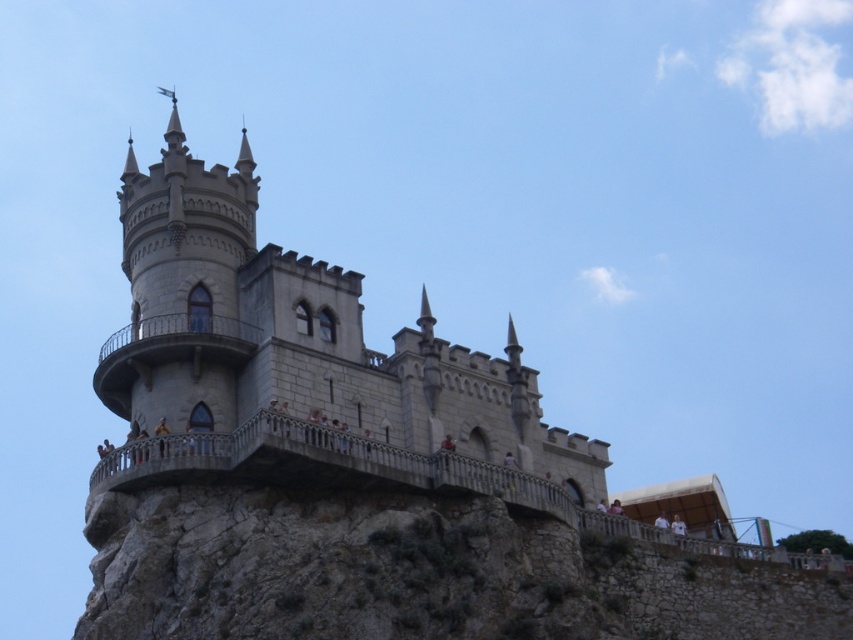
Question: Which of the following is the farthest from the observer?

Choices:
 (A) gray stone castle at center
 (B) gray stone hill at lower left

Answer: (A)

Question: Can you confirm if gray stone castle at center is positioned to the left of gray stone hill at lower left?

Choices:
 (A) no
 (B) yes

Answer: (B)

Question: Does gray stone castle at center appear on the left side of gray stone hill at lower left?

Choices:
 (A) yes
 (B) no

Answer: (A)

Question: Is gray stone castle at center positioned behind gray stone hill at lower left?

Choices:
 (A) yes
 (B) no

Answer: (A)